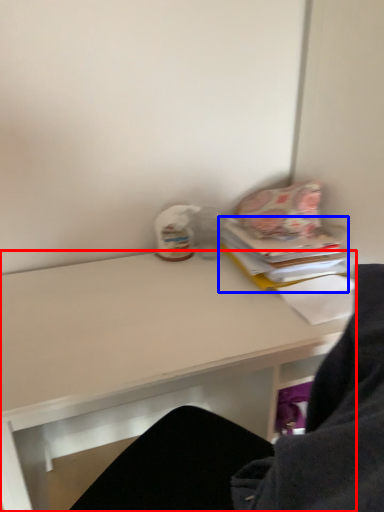
Question: Which of the following is the closest to the observer, desk (highlighted by a red box) or paperback book (highlighted by a blue box)?

Choices:
 (A) desk
 (B) paperback book

Answer: (A)